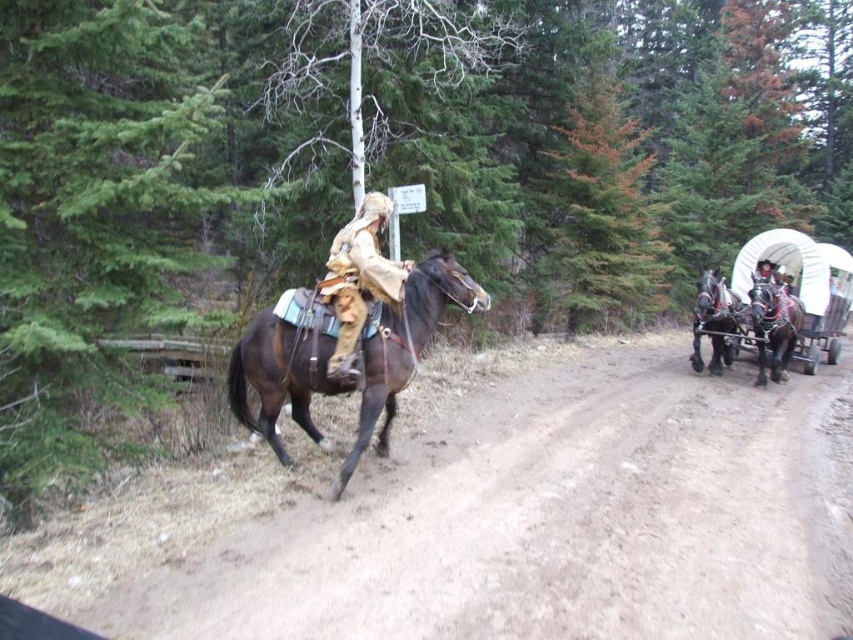
Question: Among these points, which one is farthest from the camera?

Choices:
 (A) (775, 360)
 (B) (695, 300)

Answer: (B)

Question: Can you confirm if shiny black horse at right is bigger than shiny brown horse at right?

Choices:
 (A) no
 (B) yes

Answer: (B)

Question: Estimate the real-world distances between objects in this image. Which object is farther from the shiny brown horse at right?

Choices:
 (A) shiny black horse at right
 (B) brown glossy horse at center
 (C) tan suede jacket at center
 (D) brown sandy dirt track at center

Answer: (B)

Question: Estimate the real-world distances between objects in this image. Which object is farther from the brown sandy dirt track at center?

Choices:
 (A) shiny black horse at right
 (B) shiny brown horse at right
 (C) tan suede jacket at center
 (D) brown glossy horse at center

Answer: (B)

Question: Does brown glossy horse at center appear under shiny brown horse at right?

Choices:
 (A) no
 (B) yes

Answer: (B)

Question: Can you confirm if brown glossy horse at center is positioned to the left of shiny black horse at right?

Choices:
 (A) no
 (B) yes

Answer: (B)